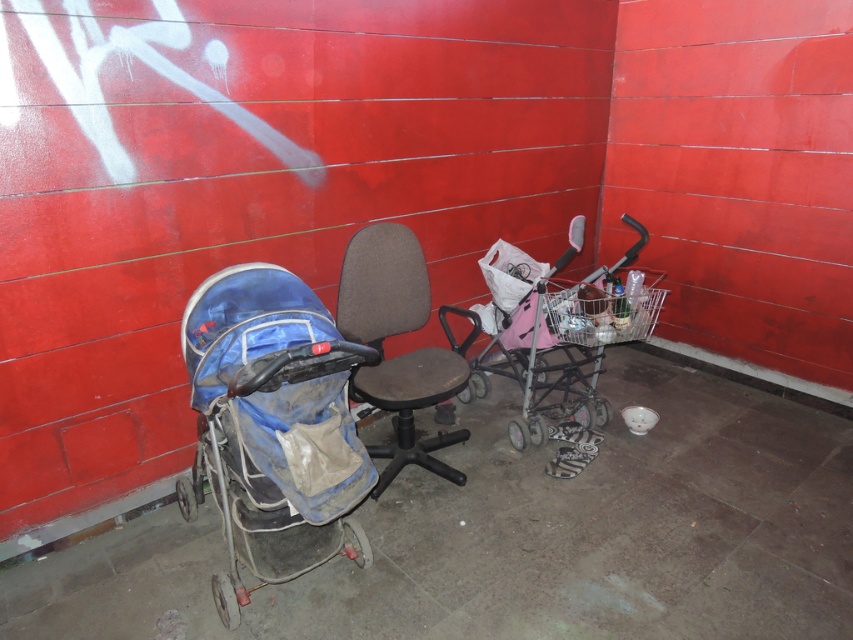
Question: Does blue fabric stroller at left appear on the left side of dark gray fabric office chair at center?

Choices:
 (A) yes
 (B) no

Answer: (A)

Question: Which point is closer to the camera taking this photo?

Choices:
 (A) click(x=454, y=356)
 (B) click(x=560, y=316)
 (C) click(x=267, y=417)

Answer: (C)

Question: Can you confirm if blue fabric stroller at left is thinner than pink metallic shopping cart at center-right?

Choices:
 (A) yes
 (B) no

Answer: (A)

Question: Is dark gray fabric office chair at center smaller than pink metallic shopping cart at center-right?

Choices:
 (A) no
 (B) yes

Answer: (B)

Question: Based on their relative distances, which object is nearer to the dark gray fabric office chair at center?

Choices:
 (A) blue fabric stroller at left
 (B) pink metallic shopping cart at center-right

Answer: (A)

Question: Which object is closer to the camera taking this photo?

Choices:
 (A) pink metallic shopping cart at center-right
 (B) blue fabric stroller at left

Answer: (B)